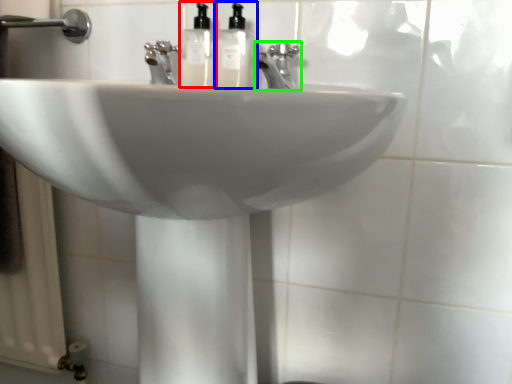
Question: Estimate the real-world distances between objects in this image. Which object is farther from soap dispenser (highlighted by a red box), soap dispenser (highlighted by a blue box) or tap (highlighted by a green box)?

Choices:
 (A) soap dispenser
 (B) tap

Answer: (B)